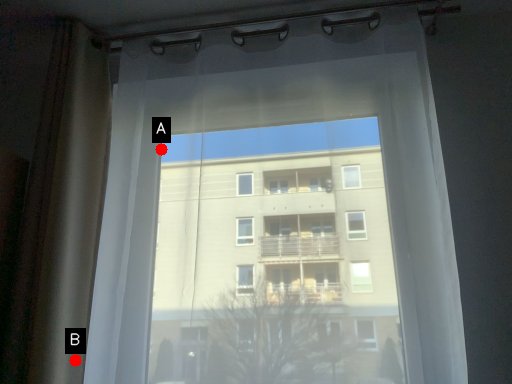
Question: Two points are circled on the image, labeled by A and B beside each circle. Which of the following is the farthest from the observer?

Choices:
 (A) A is further
 (B) B is further

Answer: (A)